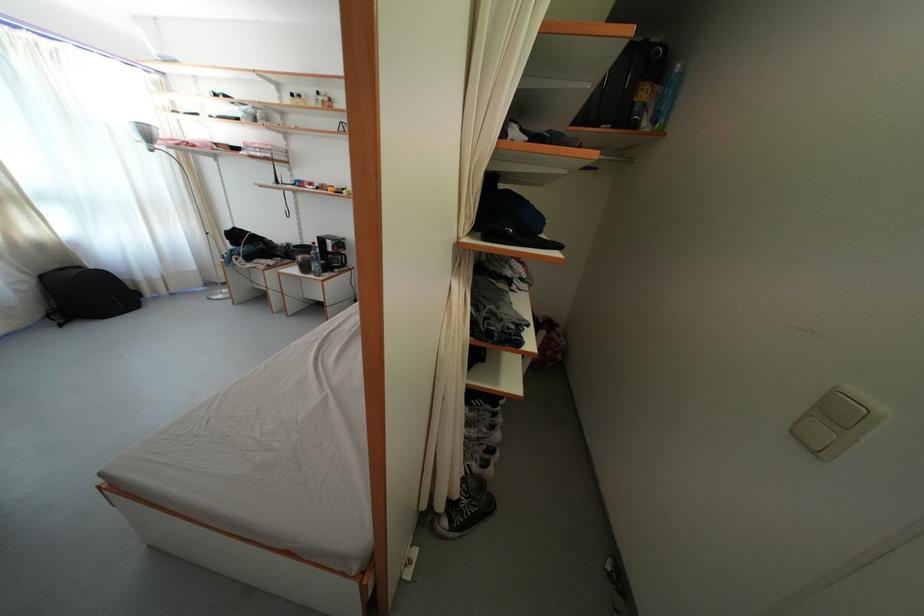
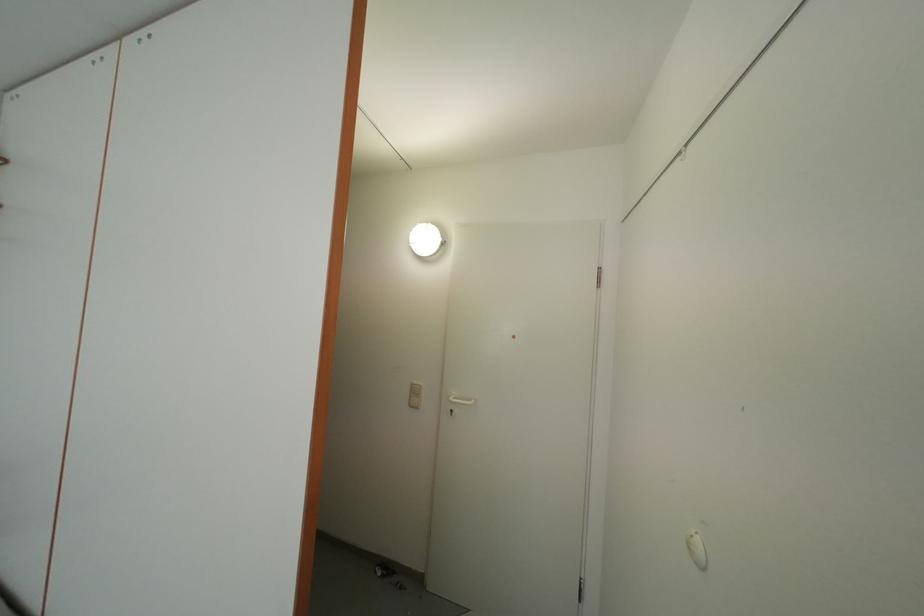
The point at (x=859, y=395) is marked in the first image. Where is the corresponding point in the second image?

(420, 387)